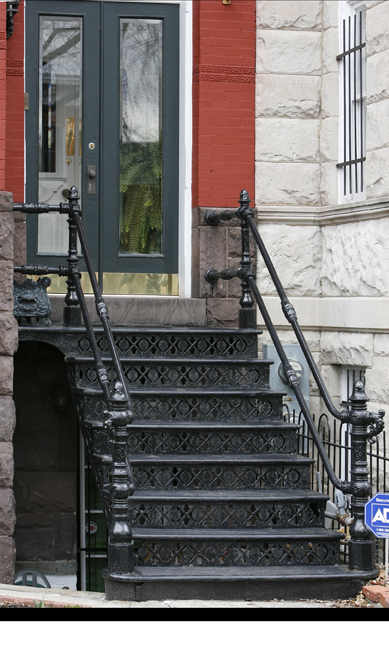
Image resolution: width=389 pixels, height=652 pixels. Identify the location of keyhole. click(92, 145).